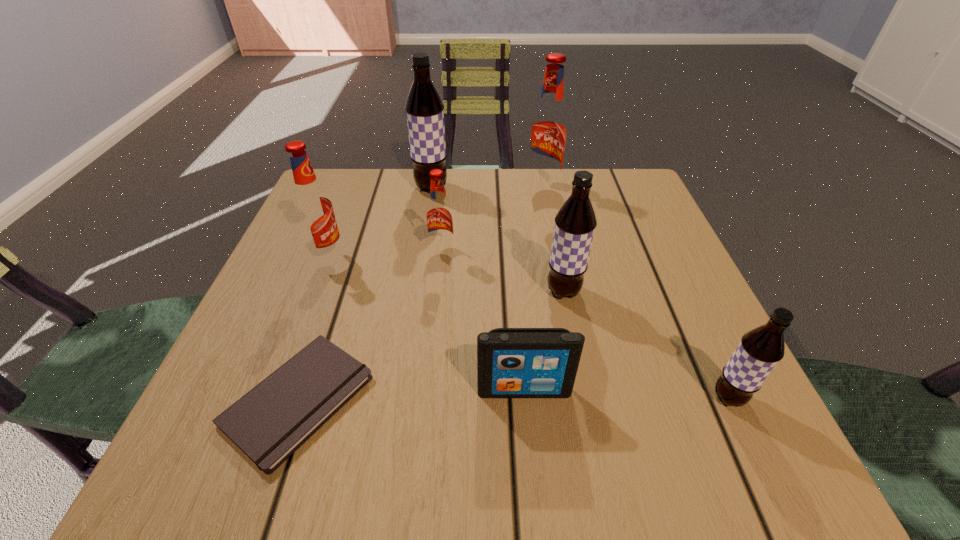
Locate an element on the screen. This screenshot has height=540, width=960. free space between the iPod and the shortest object is located at coordinates (411, 395).

Find the location of a particular element. The width and height of the screenshot is (960, 540). object that ranks as the fifth closest to the shortest object is located at coordinates (424, 108).

Find the location of a particular element. the second closest object relative to the second biggest brown root beer is located at coordinates (439, 215).

Identify which root beer is located as the fifth nearest to the rightmost object. Please provide its 2D coordinates. Your answer should be formatted as a tuple, i.e. [(x, y)], where the tuple contains the x and y coordinates of a point satisfying the conditions above.

[(312, 206)]

You are a GUI agent. You are given a task and a screenshot of the screen. Output one action in this format:
    pyautogui.click(x=<x>, y=<y>)
    Task: Click on the root beer that is the closest to the rightmost red root beer
    This screenshot has height=540, width=960.
    Given the screenshot: What is the action you would take?
    pyautogui.click(x=424, y=108)

I want to click on the closest brown root beer to the rightmost root beer, so click(575, 223).

Identify which brown root beer is the third closest to the biggest red root beer. Please provide its 2D coordinates. Your answer should be formatted as a tuple, i.e. [(x, y)], where the tuple contains the x and y coordinates of a point satisfying the conditions above.

[(759, 351)]

You are a GUI agent. You are given a task and a screenshot of the screen. Output one action in this format:
    pyautogui.click(x=<x>, y=<y>)
    Task: Click on the third closest red root beer to the biggest brown root beer
    The image size is (960, 540).
    Given the screenshot: What is the action you would take?
    pyautogui.click(x=312, y=206)

Where is `the third closest red root beer to the second smallest brown root beer`? the third closest red root beer to the second smallest brown root beer is located at coordinates (312, 206).

Where is `vacant space that satisfies the following two spatial constraints: 1. on the front side of the fourth nearest object; 2. on the right side of the farthest red root beer`? This screenshot has height=540, width=960. vacant space that satisfies the following two spatial constraints: 1. on the front side of the fourth nearest object; 2. on the right side of the farthest red root beer is located at coordinates (563, 291).